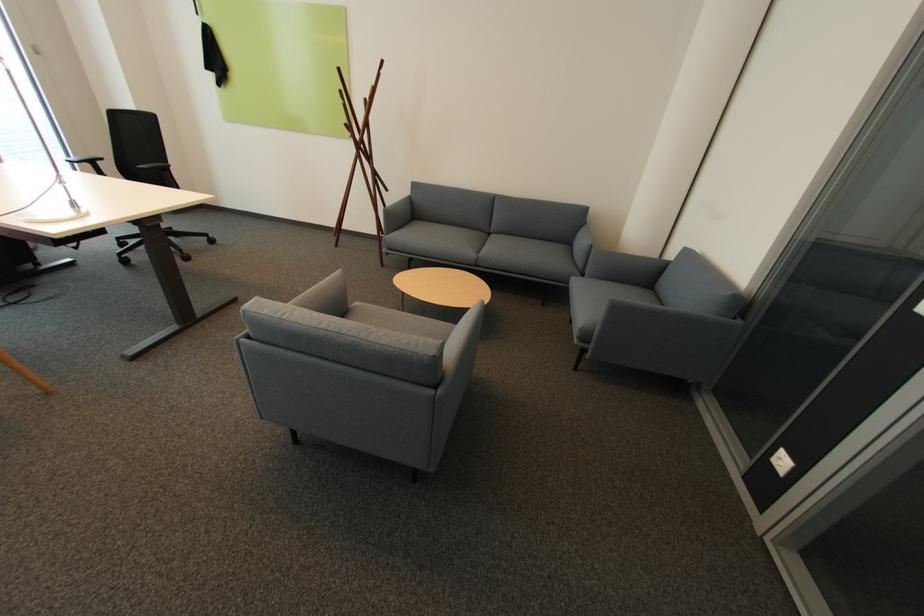
The width and height of the screenshot is (924, 616). What do you see at coordinates (626, 312) in the screenshot?
I see `a grey chair armrest` at bounding box center [626, 312].